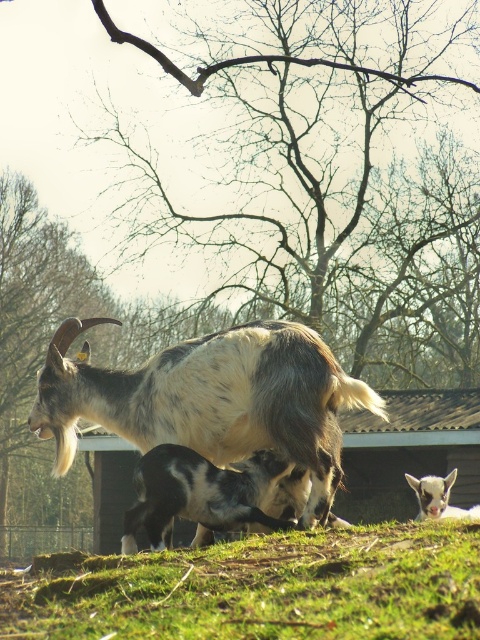
You are standing in the rural scene and want to walk towards the black and white fur at center. Which direction should you move relative to the green grassy at lower center?

To reach the black and white fur at center from the green grassy at lower center, you should move to the left since the green grassy at lower center is located to the right of the black and white fur at center.

Based on the photo, you are a photographer standing at the edge of the grassy area. You want to take a photo of the black and white fur at center without the green grassy at lower center appearing in the foreground. Is this possible?

The green grassy at lower center is closer to the viewer than the black and white fur at center, so it will block the view of the black and white fur at center. Therefore, it is not possible to take a photo of the black and white fur at center without the green grassy at lower center appearing in the foreground.